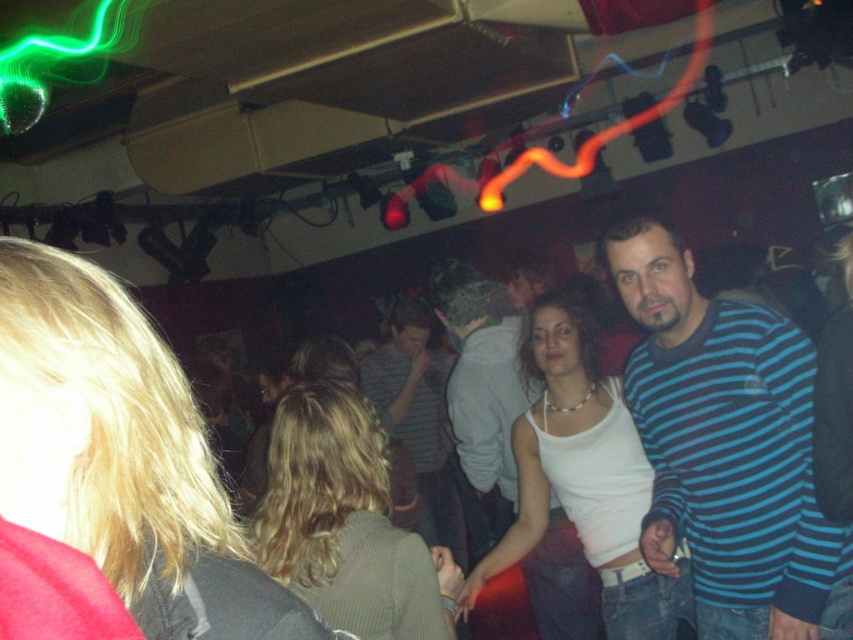
You are at a party and want to find the tallest person between the blue striped sweater at right and the striped cotton shirt at center. Which one should you approach?

The striped cotton shirt at center is taller than the blue striped sweater at right, so you should approach the striped cotton shirt at center.

You are a photographer at the party and want to capture both the blue striped sweater at right and the striped cotton shirt at center in a single frame. Which of the two clothing items requires more focus adjustment due to its size in the photo?

The striped cotton shirt at center requires more focus adjustment because it is wider than the blue striped sweater at right, meaning it may occupy more space in the frame and need precise focusing to ensure clarity across its entire width.